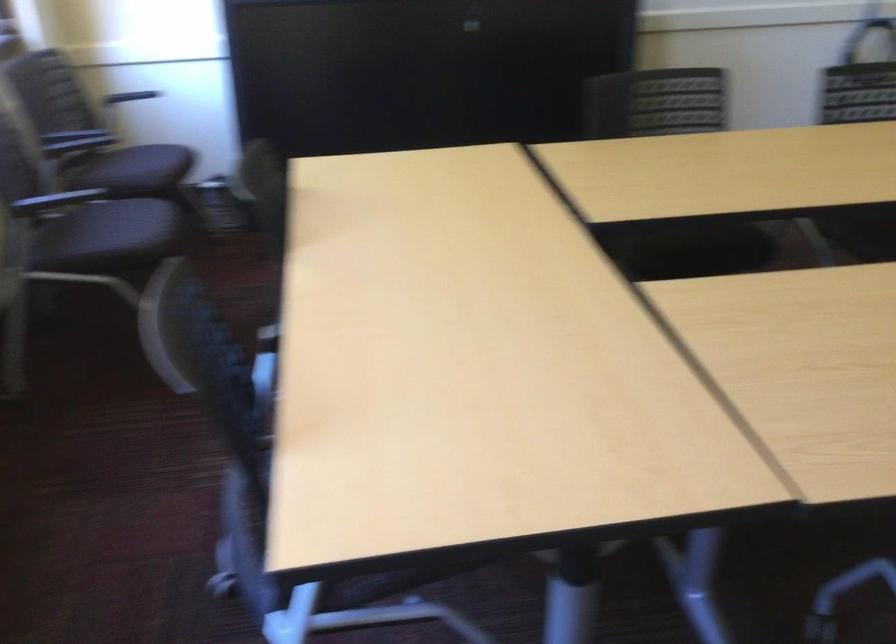
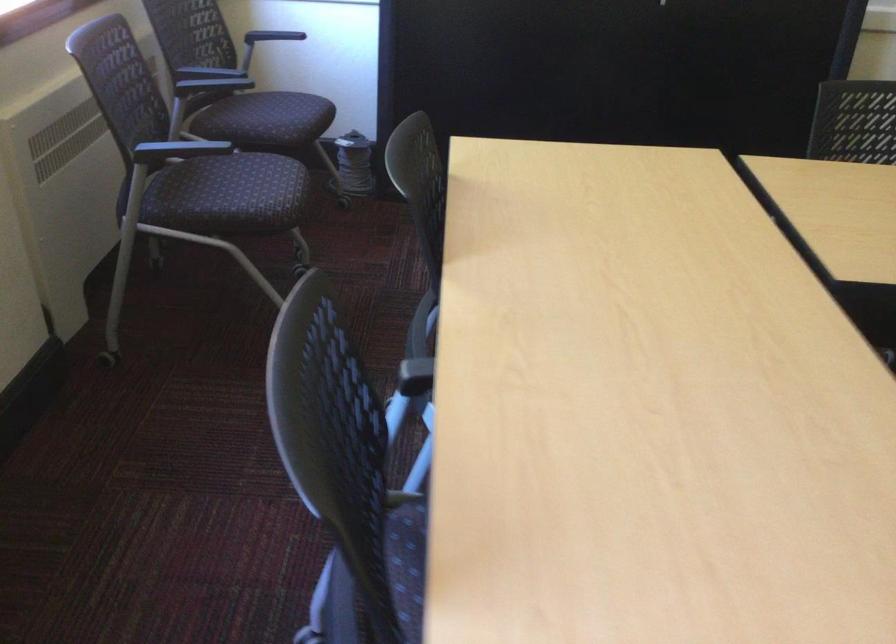
The point at (125, 239) is marked in the first image. Where is the corresponding point in the second image?

(250, 198)